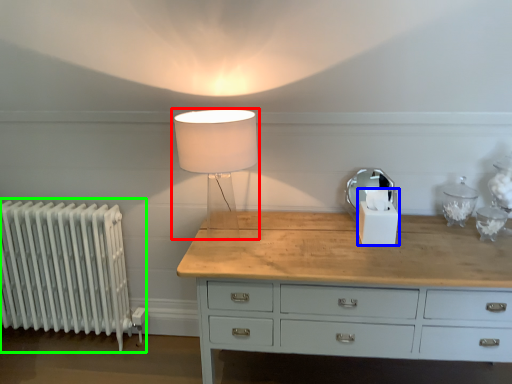
Question: Estimate the real-world distances between objects in this image. Which object is closer to lamp (highlighted by a red box), candle holder (highlighted by a blue box) or radiator (highlighted by a green box)?

Choices:
 (A) candle holder
 (B) radiator

Answer: (A)